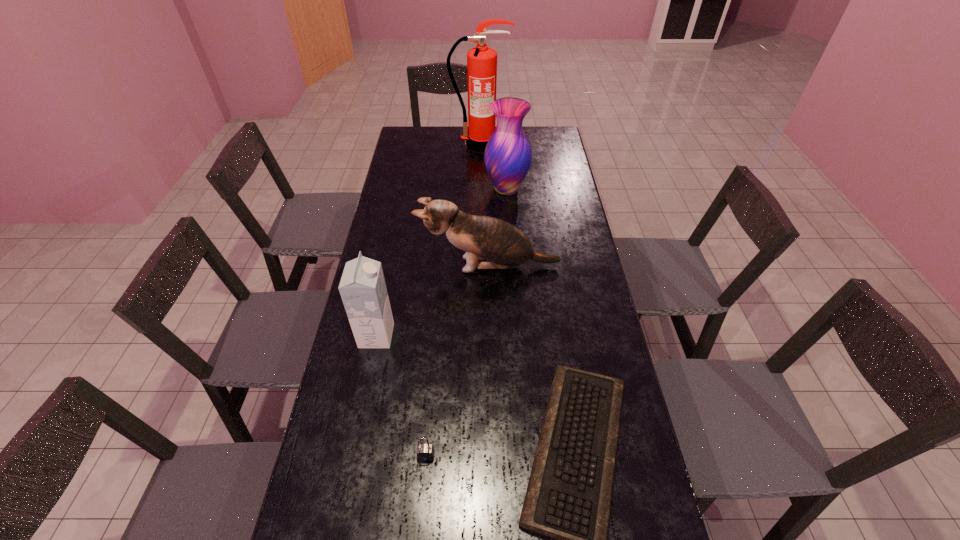
This screenshot has height=540, width=960. Find the location of `free point between the cat and the carton`. free point between the cat and the carton is located at coordinates (433, 300).

In order to click on free area in between the second farthest object and the leftmost object in this screenshot , I will do `click(442, 262)`.

This screenshot has height=540, width=960. Identify the location of free spot between the leftmost object and the fourth nearest object. (433, 300).

The width and height of the screenshot is (960, 540). Identify the location of object that stands as the second closest to the vase. (484, 238).

Identify which object is the third nearest to the fourth nearest object. Please provide its 2D coordinates. Your answer should be formatted as a tuple, i.e. [(x, y)], where the tuple contains the x and y coordinates of a point satisfying the conditions above.

[(568, 497)]